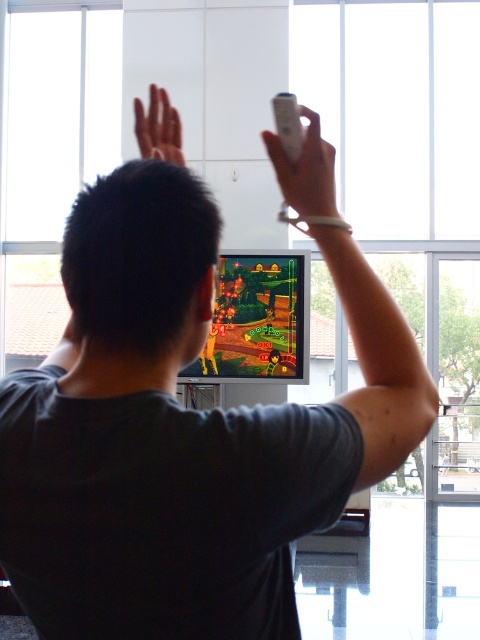
This screenshot has height=640, width=480. Describe the element at coordinates (409, 180) in the screenshot. I see `transparent glass window at upper center` at that location.

Is transparent glass window at upper center taller than smooth skin hand at upper center?

No.

Is point (456, 348) more distant than point (167, 97)?

Yes.

What are the coordinates of `transparent glass window at upper center` in the screenshot? It's located at (409, 180).

Is white matte remote control at upper center taller than smooth skin hand at upper center?

No.

Is white matte remote control at upper center smaller than smooth skin hand at upper center?

Yes, white matte remote control at upper center is smaller than smooth skin hand at upper center.

Between point (280, 182) and point (173, 161), which one is positioned behind?

Positioned behind is point (173, 161).

Locate an element on the screen. This screenshot has height=640, width=480. white matte remote control at upper center is located at coordinates (305, 170).

Measure the distance from transparent glass window at upper center to white plastic remote at upper center.

They are 9.06 meters apart.

Between point (422, 192) and point (285, 104), which one is positioned behind?

The point (422, 192) is behind.

Describe the element at coordinates (409, 180) in the screenshot. The height and width of the screenshot is (640, 480). I see `transparent glass window at upper center` at that location.

The image size is (480, 640). I want to click on transparent glass window at upper center, so click(409, 180).